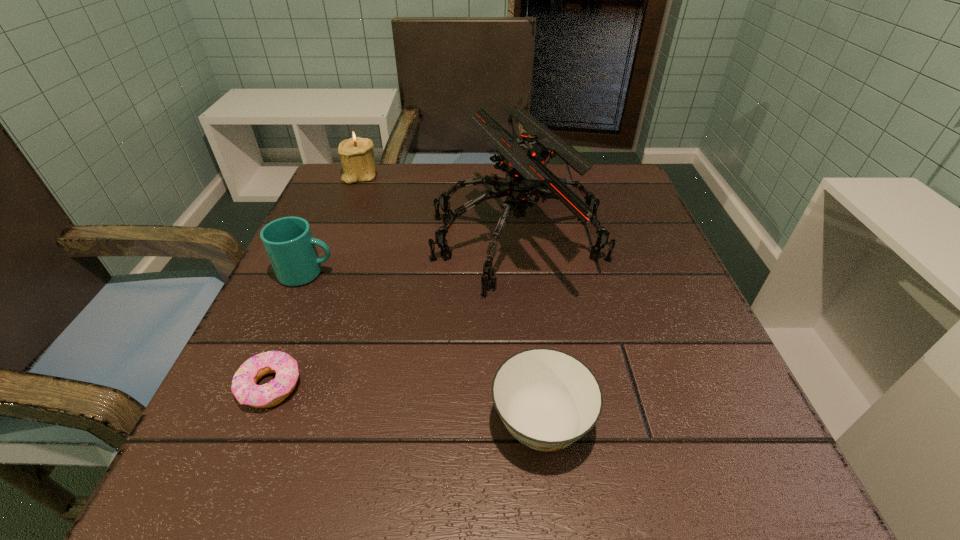
What are the coordinates of `drone` in the screenshot? It's located at (524, 159).

The image size is (960, 540). Identify the location of the farthest object. (356, 154).

Find the location of a particular element. the fourth shortest object is located at coordinates (356, 154).

Identify the location of the third shortest object. This screenshot has width=960, height=540. (288, 241).

Find the location of a particular element. The height and width of the screenshot is (540, 960). soup bowl is located at coordinates (548, 399).

In order to click on the shortest object in this screenshot , I will do `click(244, 386)`.

Identify the location of free space located on the back of the drone. (510, 163).

Where is `vacant space situated on the right of the farthest object`? This screenshot has width=960, height=540. vacant space situated on the right of the farthest object is located at coordinates (421, 176).

At what (x,y) coordinates should I click in order to perform the action: click on blank space located on the handle side of the third shortest object. Please return your answer as a coordinate pair (x, y). Image resolution: width=960 pixels, height=540 pixels. Looking at the image, I should click on (424, 273).

The height and width of the screenshot is (540, 960). What are the coordinates of `free space located on the left of the fourth tallest object` in the screenshot? It's located at (260, 423).